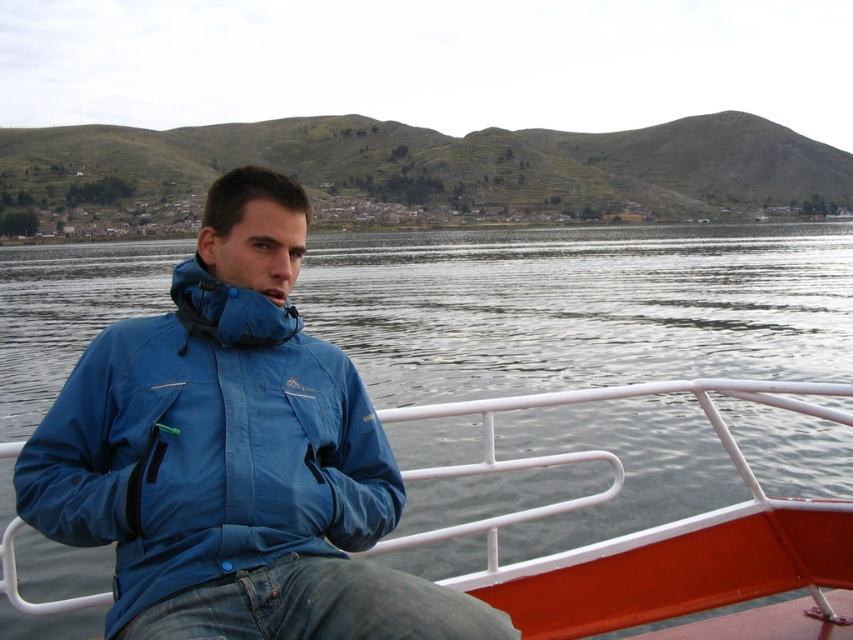
You are standing on the deck of the boat and want to take a photo of both the point at coordinates (138,358) and the point at coordinates (685,532). Which point will appear larger in your photo?

Point at coordinates (138,358) will appear larger in the photo because it is closer to the camera than point at coordinates (685,532).

You are a photographer trying to capture the blue waterproof jacket at center and the blue fabric boat at center in a single shot. Given their relative sizes, which object will appear larger in the photo?

The blue waterproof jacket at center will appear larger in the photo because it has a greater height compared to the blue fabric boat at center.